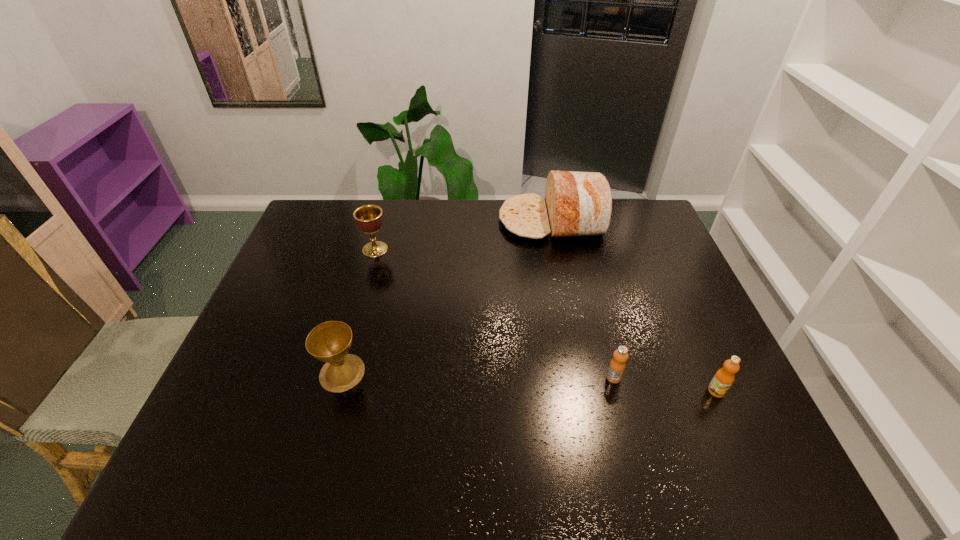
Choose which object is the fourth nearest neighbor to the left orange juice. Please provide its 2D coordinates. Your answer should be formatted as a tuple, i.e. [(x, y)], where the tuple contains the x and y coordinates of a point satisfying the conditions above.

[(369, 218)]

Locate an element on the screen. This screenshot has height=540, width=960. vacant space that satisfies the following two spatial constraints: 1. at the sliced end of the tallest object; 2. on the front side of the nearer chalice is located at coordinates (583, 373).

At what (x,y) coordinates should I click in order to perform the action: click on free spot that satisfies the following two spatial constraints: 1. on the front side of the farther chalice; 2. on the left side of the nearer chalice. Please return your answer as a coordinate pair (x, y). This screenshot has height=540, width=960. Looking at the image, I should click on (342, 373).